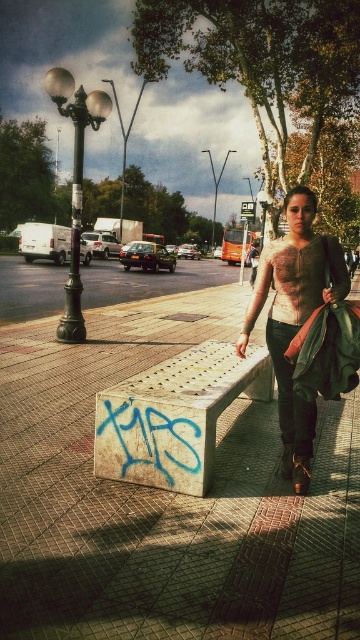
Which is behind, point (159, 572) or point (302, 480)?

The point (302, 480) is more distant.

Does concrete bench at center have a lesser height compared to textured beige sweater at center?

Yes.

This screenshot has height=640, width=360. I want to click on concrete bench at center, so [165, 500].

Which of these two, concrete bench at center or white textured bench at center, stands taller?

With more height is concrete bench at center.

Can you confirm if concrete bench at center is positioned above white textured bench at center?

Yes.

Who is more forward, (168,616) or (168,484)?

Point (168,616) is in front.

Identify the location of concrete bench at center. Image resolution: width=360 pixels, height=640 pixels. (165, 500).

Does white textured bench at center have a greater width compared to textured beige sweater at center?

Yes, white textured bench at center is wider than textured beige sweater at center.

Does white textured bench at center have a lesser width compared to textured beige sweater at center?

No, white textured bench at center is not thinner than textured beige sweater at center.

Locate an element on the screen. The height and width of the screenshot is (640, 360). white textured bench at center is located at coordinates (174, 416).